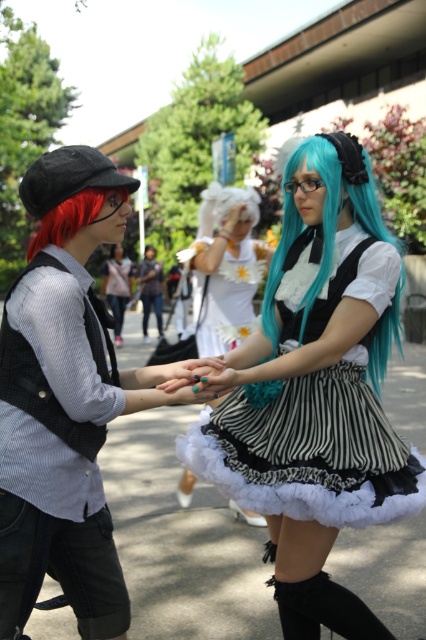
Does vivid red hair at left appear on the left side of teal nail polish at center?

Indeed, vivid red hair at left is positioned on the left side of teal nail polish at center.

Does vivid red hair at left have a lesser height compared to teal nail polish at center?

In fact, vivid red hair at left may be taller than teal nail polish at center.

Which is behind, point (97, 189) or point (175, 392)?

Point (175, 392)

Locate an element on the screen. vivid red hair at left is located at coordinates (71, 216).

The image size is (426, 640). What are the coordinates of `black and white striped dress at center` in the screenshot? It's located at (310, 449).

Between black and white striped dress at center and teal silky wig at center, which one is positioned lower?

black and white striped dress at center is below.

Does point (373, 456) come closer to viewer compared to point (382, 224)?

Yes, it is in front of point (382, 224).

Find the location of `black and white striped dress at center`. black and white striped dress at center is located at coordinates (310, 449).

Can you confirm if black and white striped dress at center is shorter than matte black wig at center?

No.

The height and width of the screenshot is (640, 426). What do you see at coordinates (310, 449) in the screenshot?
I see `black and white striped dress at center` at bounding box center [310, 449].

Where is `black and white striped dress at center`? black and white striped dress at center is located at coordinates (310, 449).